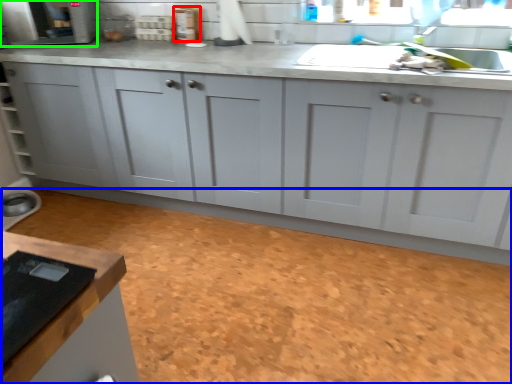
Question: Which is nearer to the appliance (highlighted by a red box)? granite (highlighted by a blue box) or appliance (highlighted by a green box).

Choices:
 (A) granite
 (B) appliance

Answer: (B)